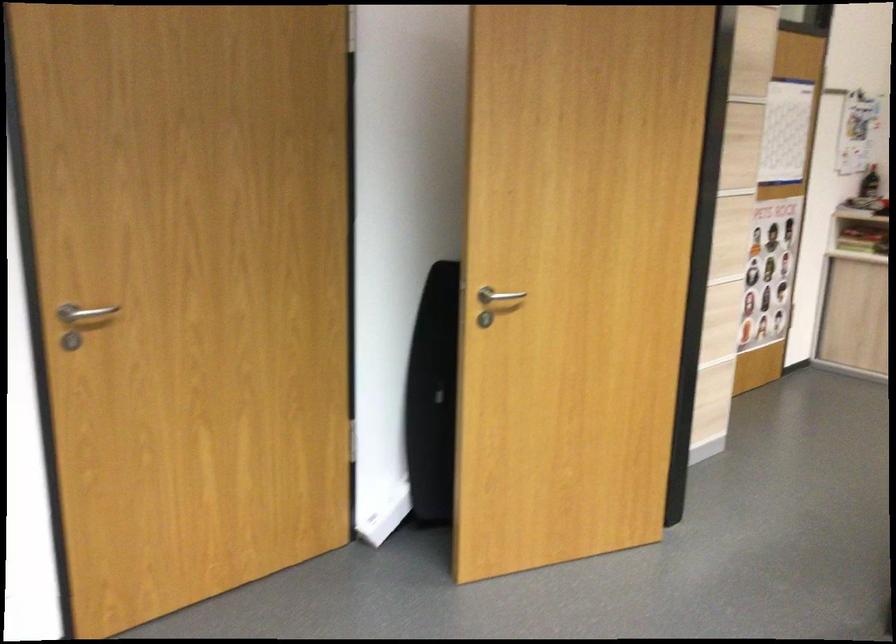
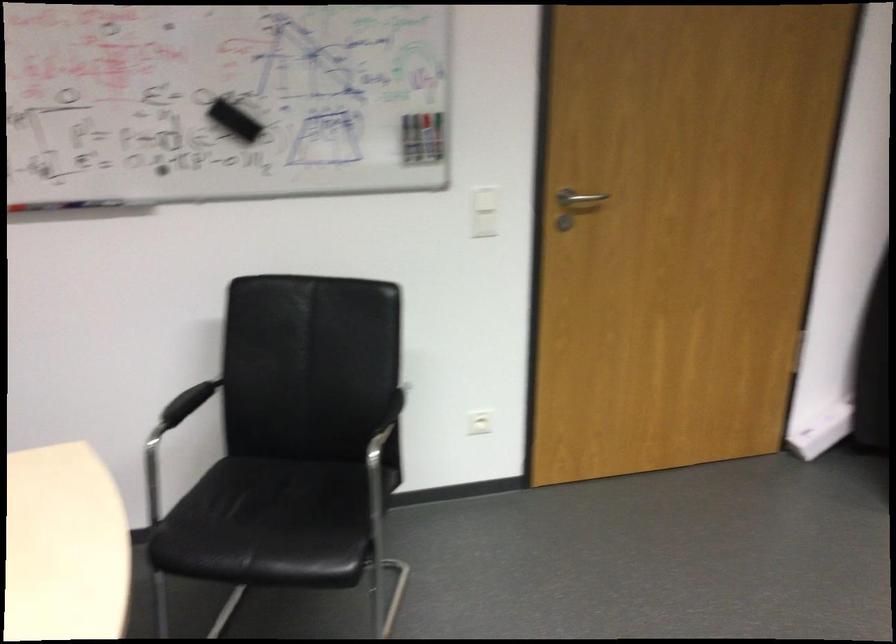
The point at (82,314) is marked in the first image. Where is the corresponding point in the second image?

(579, 199)